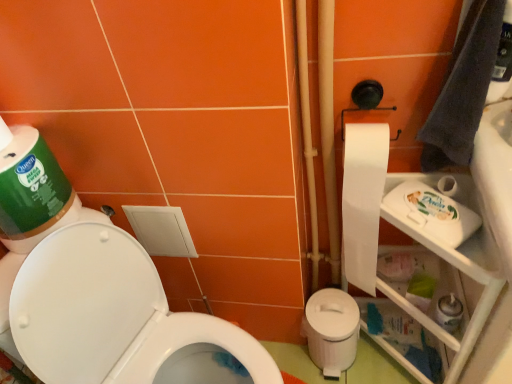
Question: Can you confirm if white paper at right is wider than white glossy toilet at lower left?

Choices:
 (A) yes
 (B) no

Answer: (B)

Question: Is white paper at right behind white glossy toilet at lower left?

Choices:
 (A) no
 (B) yes

Answer: (B)

Question: Is white paper at right oriented towards white glossy toilet at lower left?

Choices:
 (A) no
 (B) yes

Answer: (A)

Question: From the image's perspective, is white paper at right below white glossy toilet at lower left?

Choices:
 (A) yes
 (B) no

Answer: (B)

Question: Does white paper at right contain white glossy toilet at lower left?

Choices:
 (A) yes
 (B) no

Answer: (B)

Question: Considering the relative sizes of white paper at right and white glossy toilet at lower left in the image provided, is white paper at right taller than white glossy toilet at lower left?

Choices:
 (A) yes
 (B) no

Answer: (B)

Question: Does gray fabric hand towel at upper right have a smaller size compared to white paper at right?

Choices:
 (A) yes
 (B) no

Answer: (A)

Question: Can you confirm if gray fabric hand towel at upper right is bigger than white paper at right?

Choices:
 (A) yes
 (B) no

Answer: (B)

Question: Is gray fabric hand towel at upper right not close to white paper at right?

Choices:
 (A) yes
 (B) no

Answer: (B)

Question: Does gray fabric hand towel at upper right appear on the left side of white paper at right?

Choices:
 (A) yes
 (B) no

Answer: (B)

Question: Is gray fabric hand towel at upper right shorter than white paper at right?

Choices:
 (A) no
 (B) yes

Answer: (B)

Question: Considering the relative positions of gray fabric hand towel at upper right and white paper at right in the image provided, is gray fabric hand towel at upper right behind white paper at right?

Choices:
 (A) yes
 (B) no

Answer: (B)

Question: Does white paper at right touch white plastic potty at lower right?

Choices:
 (A) yes
 (B) no

Answer: (B)